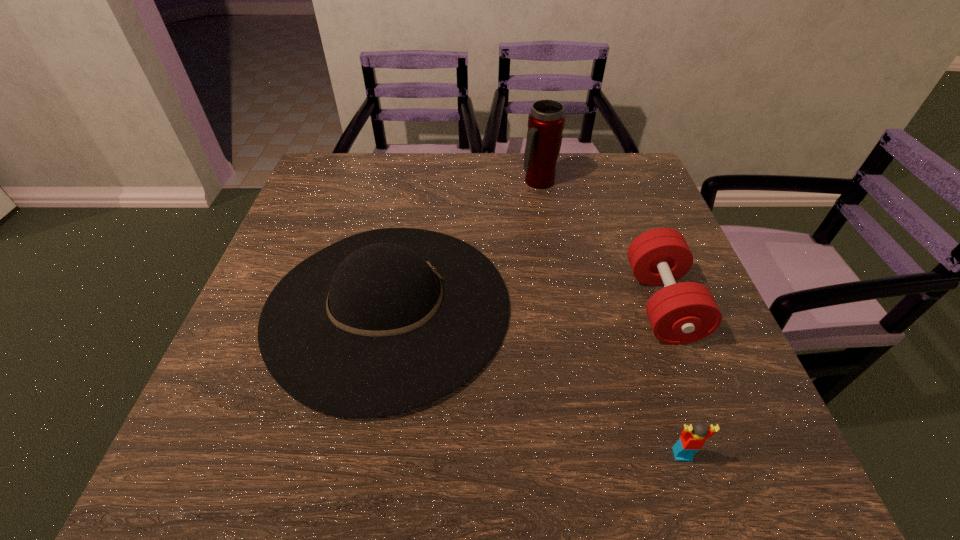
I want to click on the farthest object, so click(546, 120).

Identify the location of the second object from left to right. point(546,120).

The height and width of the screenshot is (540, 960). In order to click on the third shortest object in this screenshot , I will do `click(385, 321)`.

Locate an element on the screen. Image resolution: width=960 pixels, height=540 pixels. the leftmost object is located at coordinates (385, 321).

Locate an element on the screen. The height and width of the screenshot is (540, 960). dumbbell is located at coordinates (x=680, y=313).

The width and height of the screenshot is (960, 540). I want to click on the nearest object, so click(692, 439).

Find the location of a particular element. This screenshot has width=960, height=540. the shortest object is located at coordinates (692, 439).

This screenshot has width=960, height=540. Identify the location of blank space located on the side with the handle of the tallest object. (552, 267).

Locate an element on the screen. This screenshot has height=540, width=960. free location located on the front-facing side of the leftmost object is located at coordinates (x=660, y=307).

I want to click on free spot located on the left of the dumbbell, so click(567, 304).